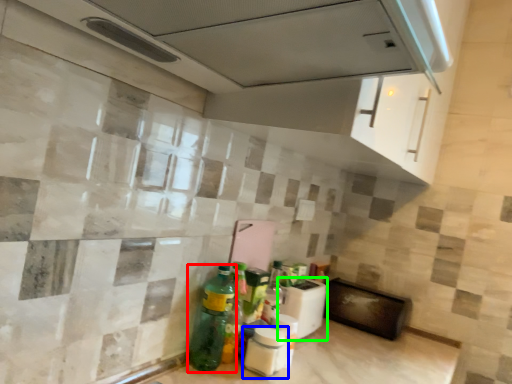
Question: Which object is the closest to the bottle (highlighted by a red box)? Choose among these: bottle (highlighted by a blue box) or appliance (highlighted by a green box).

Choices:
 (A) bottle
 (B) appliance

Answer: (A)